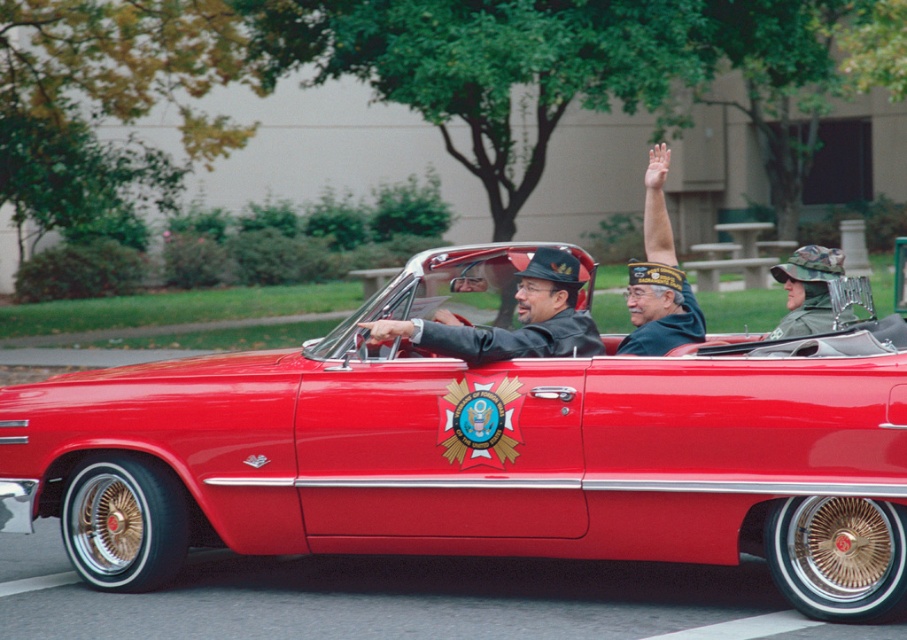
Who is more distant from viewer, (547, 429) or (632, 288)?

The point (632, 288) is more distant.

Who is shorter, shiny red car at center or green felt hat at upper center?

shiny red car at center

Find the location of a particular element. The width and height of the screenshot is (907, 640). shiny red car at center is located at coordinates pyautogui.click(x=481, y=451).

Who is more forward, (101,369) or (561,344)?

Point (561,344) is more forward.

Who is positioned more to the left, shiny red car at center or shiny black hat at center?

Positioned to the left is shiny red car at center.

The width and height of the screenshot is (907, 640). I want to click on shiny red car at center, so click(x=481, y=451).

Is the position of shiny black hat at center more distant than that of green felt hat at upper center?

No, it is not.

The height and width of the screenshot is (640, 907). Identify the location of shiny black hat at center. (517, 316).

Find the location of a particular element. shiny black hat at center is located at coordinates (517, 316).